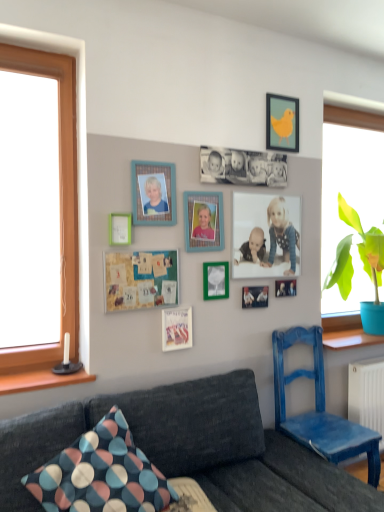
Locate an element on the screen. Image resolution: width=384 pixels, height=512 pixels. metallic silver photo frame at center, which is the 8th picture frame from top to bottom is located at coordinates (285, 288).

This screenshot has height=512, width=384. What are the coordinates of `black matte photo frame at center, arranged as the 2th picture frame when viewed from the top` in the screenshot? It's located at (243, 167).

Find the location of a particular element. Image resolution: width=384 pixels, height=512 pixels. green leafy plant in blue pot at right is located at coordinates (366, 246).

Measure the distance between matte black picture frame at center, the 9th picture frame positioned from the top, and camera.

matte black picture frame at center, the 9th picture frame positioned from the top, is 2.52 meters from camera.

Where is `green fabric bulletin board at center`? This screenshot has height=512, width=384. green fabric bulletin board at center is located at coordinates (140, 280).

The width and height of the screenshot is (384, 512). I want to click on metallic silver photo frame at center, which is the 8th picture frame from top to bottom, so click(x=285, y=288).

Between polka dot fabric pillow at lower left and matte yellow bird at upper right, which is the tenth picture frame in bottom-to-top order, which one has larger size?

With larger size is polka dot fabric pillow at lower left.

Which object is further away from the camera, polka dot fabric pillow at lower left or matte yellow bird at upper right, which is the tenth picture frame in bottom-to-top order?

matte yellow bird at upper right, which is the tenth picture frame in bottom-to-top order.

Is polka dot fabric pillow at lower left wider than matte yellow bird at upper right, which is the tenth picture frame in bottom-to-top order?

Indeed, polka dot fabric pillow at lower left has a greater width compared to matte yellow bird at upper right, which is the tenth picture frame in bottom-to-top order.

How much distance is there between polka dot fabric pillow at lower left and matte yellow bird at upper right, placed as the first picture frame when sorted from top to bottom?

polka dot fabric pillow at lower left is 1.92 meters from matte yellow bird at upper right, placed as the first picture frame when sorted from top to bottom.

From the image's perspective, is dark gray fabric couch at lower left above matte yellow bird at upper right, which is the tenth picture frame in bottom-to-top order?

No, from the image's perspective, dark gray fabric couch at lower left is not on top of matte yellow bird at upper right, which is the tenth picture frame in bottom-to-top order.

From a real-world perspective, is dark gray fabric couch at lower left located higher than matte yellow bird at upper right, which is the tenth picture frame in bottom-to-top order?

No, from a real-world perspective, dark gray fabric couch at lower left is not over matte yellow bird at upper right, which is the tenth picture frame in bottom-to-top order

Can you confirm if dark gray fabric couch at lower left is taller than matte yellow bird at upper right, placed as the first picture frame when sorted from top to bottom?

Indeed, dark gray fabric couch at lower left has a greater height compared to matte yellow bird at upper right, placed as the first picture frame when sorted from top to bottom.

Which object is further away from the camera taking this photo, dark gray fabric couch at lower left or matte yellow bird at upper right, which is the tenth picture frame in bottom-to-top order?

matte yellow bird at upper right, which is the tenth picture frame in bottom-to-top order, is more distant.

Is matte plastic picture frame at center, positioned as the tenth picture frame in top-to-bottom order, positioned far away from matte black picture frame at center, placed as the second picture frame when sorted from bottom to top?

matte plastic picture frame at center, positioned as the tenth picture frame in top-to-bottom order, is near matte black picture frame at center, placed as the second picture frame when sorted from bottom to top, not far away.

From a real-world perspective, is matte plastic picture frame at center, which is counted as the first picture frame, starting from the bottom, located higher than matte black picture frame at center, placed as the second picture frame when sorted from bottom to top?

No, from a real-world perspective, matte plastic picture frame at center, which is counted as the first picture frame, starting from the bottom, is not above matte black picture frame at center, placed as the second picture frame when sorted from bottom to top.

Does matte plastic picture frame at center, positioned as the tenth picture frame in top-to-bottom order, have a greater width compared to matte black picture frame at center, the 9th picture frame positioned from the top?

Correct, the width of matte plastic picture frame at center, positioned as the tenth picture frame in top-to-bottom order, exceeds that of matte black picture frame at center, the 9th picture frame positioned from the top.

Which object is further away from the camera taking this photo, matte plastic picture frame at center, which is counted as the first picture frame, starting from the bottom, or matte black picture frame at center, the 9th picture frame positioned from the top?

matte black picture frame at center, the 9th picture frame positioned from the top, is further from the camera.

Is matte white photo frame at center, marked as the 5th picture frame in a bottom-to-top arrangement, placed right next to polka dot fabric pillow at lower left?

matte white photo frame at center, marked as the 5th picture frame in a bottom-to-top arrangement, and polka dot fabric pillow at lower left are clearly separated.

Which is closer, (279,196) or (160,485)?

Point (279,196) is farther from the camera than point (160,485).

From the image's perspective, between matte white photo frame at center, which ranks as the sixth picture frame in top-to-bottom order, and polka dot fabric pillow at lower left, which one is located above?

matte white photo frame at center, which ranks as the sixth picture frame in top-to-bottom order.

From a real-world perspective, is matte white photo frame at center, marked as the 5th picture frame in a bottom-to-top arrangement, above or below polka dot fabric pillow at lower left?

In terms of real-world spatial position, matte white photo frame at center, marked as the 5th picture frame in a bottom-to-top arrangement, is above polka dot fabric pillow at lower left.

Is green matte picture frame at center, which appears as the seventh picture frame when viewed from the top, beside matte plastic picture frame at center, which is counted as the first picture frame, starting from the bottom?

No, green matte picture frame at center, which appears as the seventh picture frame when viewed from the top, is not with matte plastic picture frame at center, which is counted as the first picture frame, starting from the bottom.

Is matte plastic picture frame at center, positioned as the tenth picture frame in top-to-bottom order, surrounded by green matte picture frame at center, which ranks as the 4th picture frame in bottom-to-top order?

Actually, matte plastic picture frame at center, positioned as the tenth picture frame in top-to-bottom order, is outside green matte picture frame at center, which ranks as the 4th picture frame in bottom-to-top order.

Measure the distance between green matte picture frame at center, which appears as the seventh picture frame when viewed from the top, and matte plastic picture frame at center, positioned as the tenth picture frame in top-to-bottom order.

A distance of 9.87 inches exists between green matte picture frame at center, which appears as the seventh picture frame when viewed from the top, and matte plastic picture frame at center, positioned as the tenth picture frame in top-to-bottom order.

Is green matte picture frame at center, which appears as the seventh picture frame when viewed from the top, to the right of matte plastic picture frame at center, positioned as the tenth picture frame in top-to-bottom order, from the viewer's perspective?

Yes, green matte picture frame at center, which appears as the seventh picture frame when viewed from the top, is to the right of matte plastic picture frame at center, positioned as the tenth picture frame in top-to-bottom order.

Would you say green matte picture frame at center, which appears as the seventh picture frame when viewed from the top, is inside or outside dark gray fabric couch at lower left?

green matte picture frame at center, which appears as the seventh picture frame when viewed from the top, lies outside dark gray fabric couch at lower left.

Looking at their sizes, would you say green matte picture frame at center, which appears as the seventh picture frame when viewed from the top, is wider or thinner than dark gray fabric couch at lower left?

A: In the image, green matte picture frame at center, which appears as the seventh picture frame when viewed from the top, appears to be more narrow than dark gray fabric couch at lower left.

Based on the photo, which is more to the left, green matte picture frame at center, which appears as the seventh picture frame when viewed from the top, or dark gray fabric couch at lower left?

green matte picture frame at center, which appears as the seventh picture frame when viewed from the top.

Which is nearer, (266, 164) or (255, 271)?

Positioned in front is point (255, 271).

Considering the relative sizes of black matte photo frame at center, arranged as the 9th picture frame when ordered from the bottom, and matte white photo frame at center, marked as the 5th picture frame in a bottom-to-top arrangement, in the image provided, is black matte photo frame at center, arranged as the 9th picture frame when ordered from the bottom, thinner than matte white photo frame at center, marked as the 5th picture frame in a bottom-to-top arrangement,?

No.

The image size is (384, 512). Find the location of `picture frame that is the 10th object above the polka dot fabric pillow at lower left (from a real-world perspective)`. picture frame that is the 10th object above the polka dot fabric pillow at lower left (from a real-world perspective) is located at coordinates (282, 123).

At what (x,y) coordinates should I click in order to perform the action: click on the 4th picture frame counting from the right of the dark gray fabric couch at lower left. Please return your answer as a coordinate pair (x, y). The image size is (384, 512). Looking at the image, I should click on (282, 123).

Estimate the real-world distances between objects in this image. Which object is closer to black matte photo frame at center, arranged as the 9th picture frame when ordered from the bottom, matte yellow bird at upper right, placed as the first picture frame when sorted from top to bottom, or blue painted wood chair at right?

matte yellow bird at upper right, placed as the first picture frame when sorted from top to bottom.

Consider the image. Estimate the real-world distances between objects in this image. Which object is closer to matte blue picture frame at upper left, which appears as the 3th picture frame when viewed from the top, green leafy plant in blue pot at right or matte yellow bird at upper right, placed as the first picture frame when sorted from top to bottom?

matte yellow bird at upper right, placed as the first picture frame when sorted from top to bottom.

Considering their positions, is green matte picture frame at center, which appears as the seventh picture frame when viewed from the top, positioned closer to green matte picture frame at upper left, positioned as the sixth picture frame in bottom-to-top order, than matte plastic picture frame at center, positioned as the tenth picture frame in top-to-bottom order?

matte plastic picture frame at center, positioned as the tenth picture frame in top-to-bottom order, lies closer to green matte picture frame at upper left, positioned as the sixth picture frame in bottom-to-top order, than the other object.

Considering their positions, is wooden photo frame at center, the seventh picture frame from the bottom, positioned closer to matte white photo frame at center, marked as the 5th picture frame in a bottom-to-top arrangement, than dark gray fabric couch at lower left?

wooden photo frame at center, the seventh picture frame from the bottom, lies closer to matte white photo frame at center, marked as the 5th picture frame in a bottom-to-top arrangement, than the other object.

Looking at the image, which one is located further to blue painted wood chair at right, dark gray fabric couch at lower left or matte black picture frame at center, placed as the second picture frame when sorted from bottom to top?

Among the two, matte black picture frame at center, placed as the second picture frame when sorted from bottom to top, is located further to blue painted wood chair at right.

From the image, which object appears to be nearer to matte white photo frame at center, which ranks as the sixth picture frame in top-to-bottom order, green matte picture frame at center, which ranks as the 4th picture frame in bottom-to-top order, or matte plastic picture frame at center, positioned as the tenth picture frame in top-to-bottom order?

Based on the image, green matte picture frame at center, which ranks as the 4th picture frame in bottom-to-top order, appears to be nearer to matte white photo frame at center, which ranks as the sixth picture frame in top-to-bottom order.

Which object lies further to the anchor point matte plastic picture frame at center, which is counted as the first picture frame, starting from the bottom, wooden photo frame at center, positioned as the fourth picture frame in top-to-bottom order, or green matte picture frame at upper left, arranged as the fifth picture frame when viewed from the top?

Among the two, green matte picture frame at upper left, arranged as the fifth picture frame when viewed from the top, is located further to matte plastic picture frame at center, which is counted as the first picture frame, starting from the bottom.

Based on the photo, looking at the image, which one is located closer to matte plastic picture frame at center, positioned as the tenth picture frame in top-to-bottom order, matte black picture frame at center, placed as the second picture frame when sorted from bottom to top, or green matte picture frame at center, which ranks as the 4th picture frame in bottom-to-top order?

green matte picture frame at center, which ranks as the 4th picture frame in bottom-to-top order.

At what (x,y) coordinates should I click in order to perform the action: click on chair between green fabric bulletin board at center and green leafy plant in blue pot at right from left to right. Please return your answer as a coordinate pair (x, y). The height and width of the screenshot is (512, 384). Looking at the image, I should click on point(319,409).

Find the location of a particular element. The height and width of the screenshot is (512, 384). bulletin board between green matte picture frame at upper left, arranged as the fifth picture frame when viewed from the top, and matte white photo frame at center, which ranks as the sixth picture frame in top-to-bottom order, in the horizontal direction is located at coordinates (140, 280).

The height and width of the screenshot is (512, 384). Identify the location of bulletin board positioned between dark gray fabric couch at lower left and matte blue picture frame at upper left, acting as the eighth picture frame starting from the bottom, from near to far. (140, 280).

The image size is (384, 512). In order to click on pillow between black matte photo frame at center, arranged as the 2th picture frame when viewed from the top, and blue painted wood chair at right from top to bottom in this screenshot , I will do `click(101, 474)`.